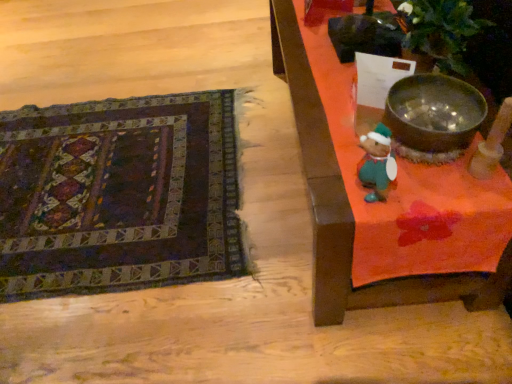
Question: Considering the positions of dark woven rug at lower left and wooden table at right in the image, is dark woven rug at lower left bigger or smaller than wooden table at right?

Choices:
 (A) big
 (B) small

Answer: (B)

Question: Visually, is dark woven rug at lower left positioned to the left or to the right of wooden table at right?

Choices:
 (A) right
 (B) left

Answer: (B)

Question: Based on their relative distances, which object is nearer to the shiny metallic bowl at upper right?

Choices:
 (A) wooden table at right
 (B) dark woven rug at lower left

Answer: (A)

Question: Which object is positioned farthest from the shiny metallic bowl at upper right?

Choices:
 (A) wooden table at right
 (B) dark woven rug at lower left

Answer: (B)